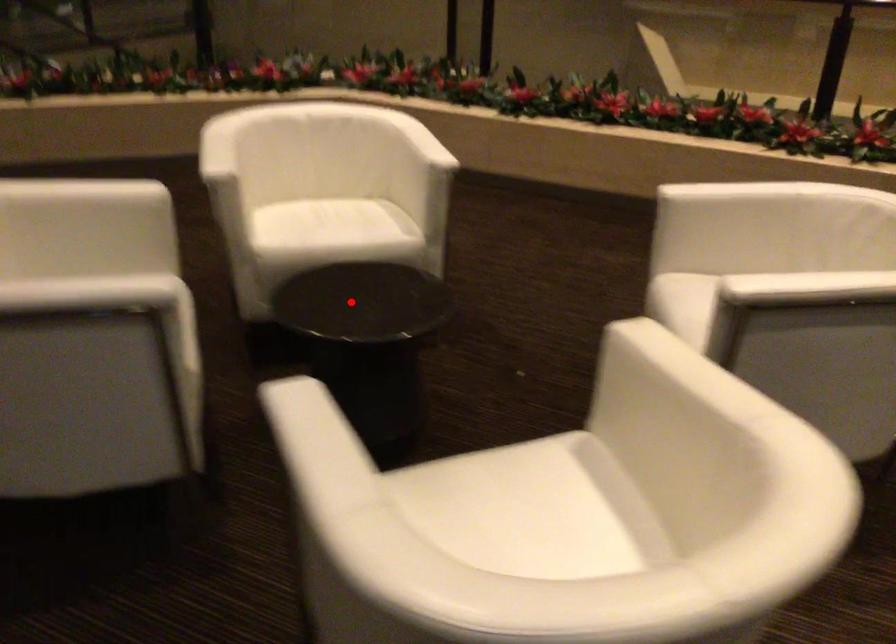
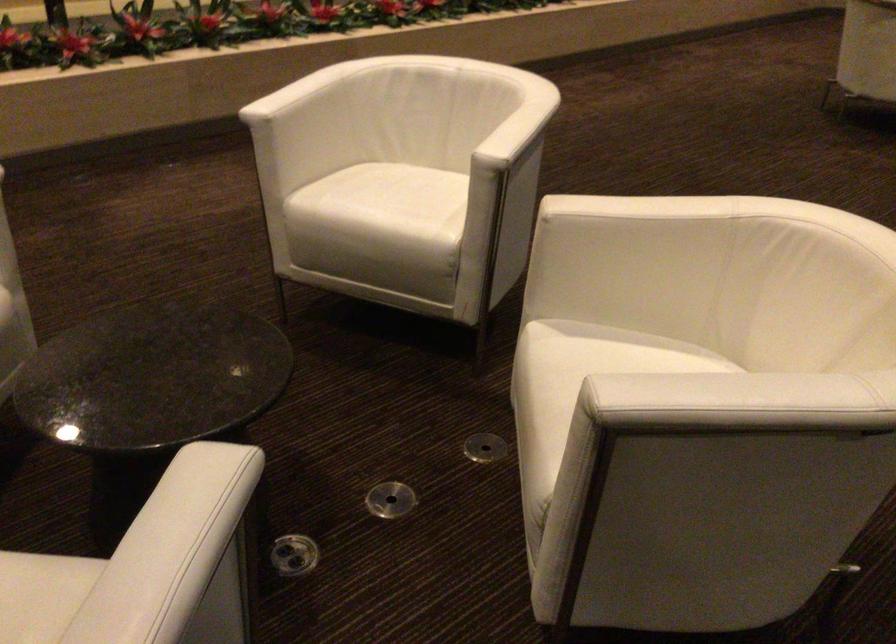
Question: A red point is marked in image1. In image2, is the corresponding 3D point closer to the camera or farther? Reply with the corresponding letter.

Choices:
 (A) The corresponding 3D point is closer.
 (B) The corresponding 3D point is farther.

Answer: (A)